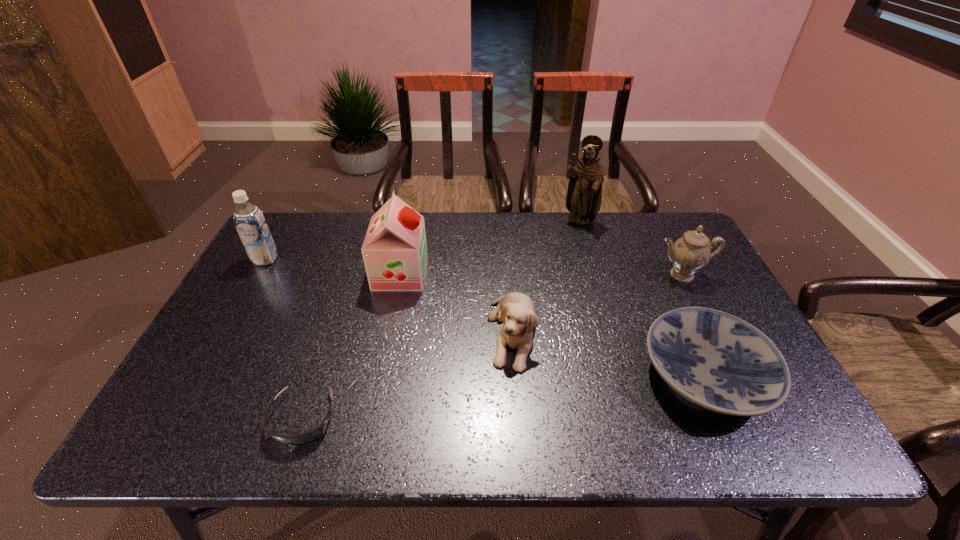
This screenshot has width=960, height=540. I want to click on free space located 0.310m on the front-facing side of the farthest object, so click(x=600, y=298).

Where is `free space located 0.270m with the cap open on the fifth object from right to left`? This screenshot has width=960, height=540. free space located 0.270m with the cap open on the fifth object from right to left is located at coordinates (516, 274).

Identify the location of free space located on the label of the leftmost object. (226, 329).

The width and height of the screenshot is (960, 540). I want to click on vacant space located on the spout of the fourth tallest object, so click(x=723, y=356).

This screenshot has width=960, height=540. What are the coordinates of `blank area located on the front-facing side of the third shortest object` in the screenshot? It's located at (519, 437).

Image resolution: width=960 pixels, height=540 pixels. I want to click on blank space located on the back of the second shortest object, so click(x=674, y=305).

At what (x,y) coordinates should I click in order to perform the action: click on figurine that is at the far edge. Please return your answer as a coordinate pair (x, y). Looking at the image, I should click on (584, 194).

Identify the location of soya milk situated at the far edge. The image size is (960, 540). (251, 225).

Locate an element on the screen. The image size is (960, 540). plate that is at the near edge is located at coordinates (718, 361).

Locate an element on the screen. goggles at the near edge is located at coordinates (300, 439).